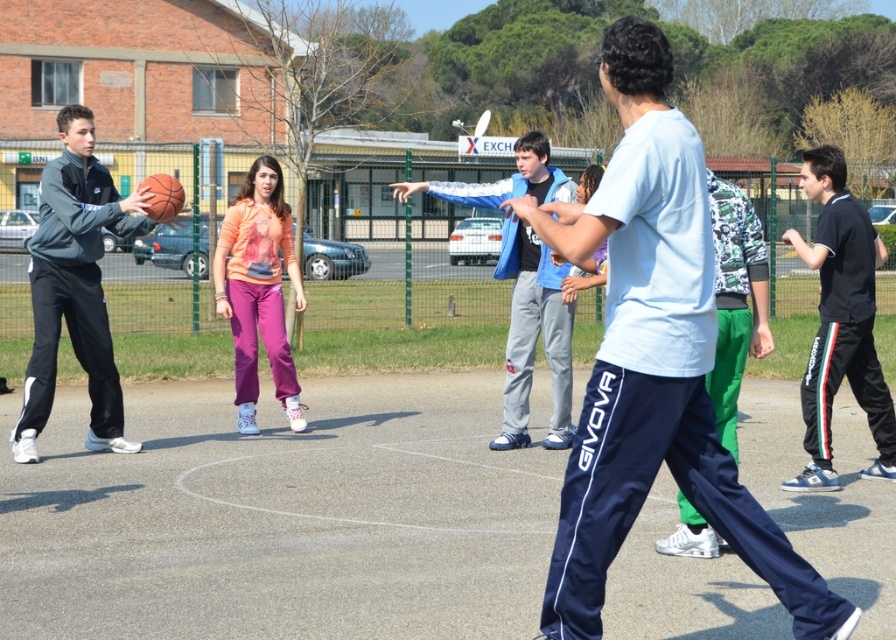
Which of these two, white matte shirt at center or orange soft sweatshirt at center, stands shorter?

Standing shorter between the two is orange soft sweatshirt at center.

Is the position of white matte shirt at center more distant than that of orange soft sweatshirt at center?

No, it is not.

Locate an element on the screen. white matte shirt at center is located at coordinates (653, 360).

Can you confirm if white matte shirt at center is shorter than black smooth tracksuit at right?

No.

Image resolution: width=896 pixels, height=640 pixels. What do you see at coordinates (653, 360) in the screenshot? I see `white matte shirt at center` at bounding box center [653, 360].

Which is behind, point (521, 216) or point (824, 296)?

Point (824, 296)

Where is `white matte shirt at center`? white matte shirt at center is located at coordinates (653, 360).

Looking at this image, is dark gray track pants at left smaller than orange soft sweatshirt at center?

Actually, dark gray track pants at left might be larger than orange soft sweatshirt at center.

The height and width of the screenshot is (640, 896). Identify the location of dark gray track pants at left. (75, 285).

The width and height of the screenshot is (896, 640). What do you see at coordinates (75, 285) in the screenshot?
I see `dark gray track pants at left` at bounding box center [75, 285].

At what (x,y) coordinates should I click in order to perform the action: click on dark gray track pants at left. Please return your answer as a coordinate pair (x, y). Looking at the image, I should click on (75, 285).